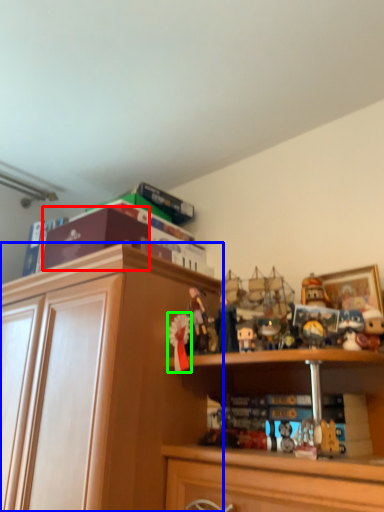
Question: Estimate the real-world distances between objects in this image. Which object is farther from book (highlighted by a red box), cabinetry (highlighted by a blue box) or toy (highlighted by a green box)?

Choices:
 (A) cabinetry
 (B) toy

Answer: (B)